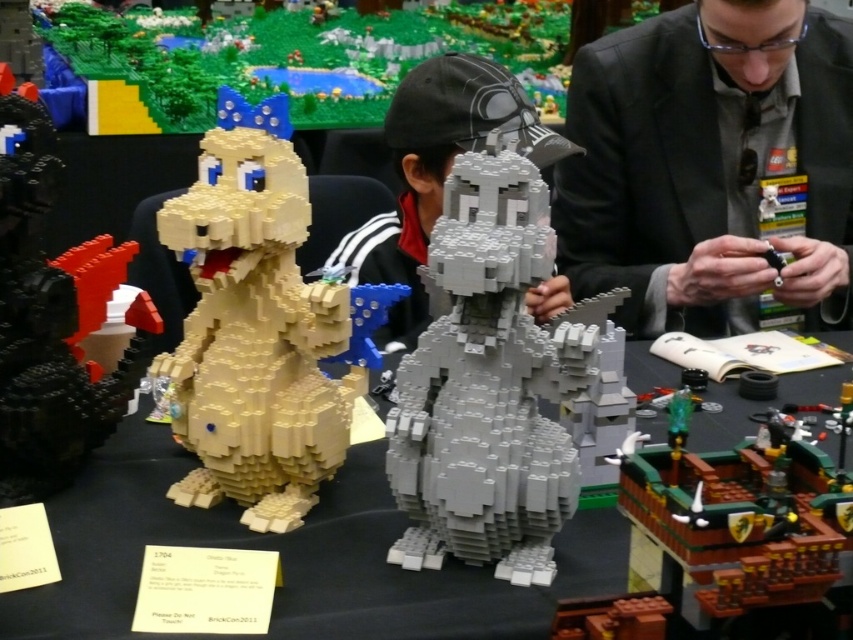
You are at a LEGO exhibition and want to place a new LEGO model on the matte plastic table at center. What is the exact 2D coordinate where you should place it?

The exact 2D coordinate for the matte plastic table at center is point [289,556].

You are a LEGO enthusiast attending the convention and want to take a photo of the matte yellow lego dinosaur at left. If you are standing at the entrance, which is at the far right of the image, which direction should you face to capture the dinosaur in your shot?

The matte yellow lego dinosaur at left is located at point (254, 326), so you should face towards the left side of the image to capture it in your photo.

You are at the LEGO exhibition and want to take a photo of both point of interest marked as point (x=550, y=556) and point (x=418, y=292). Which point should you focus on first to ensure both are in the frame?

You should focus on point (x=418, y=292) first since it is farther from the viewer than point (x=550, y=556), ensuring both are in the frame when focusing on the farther one.